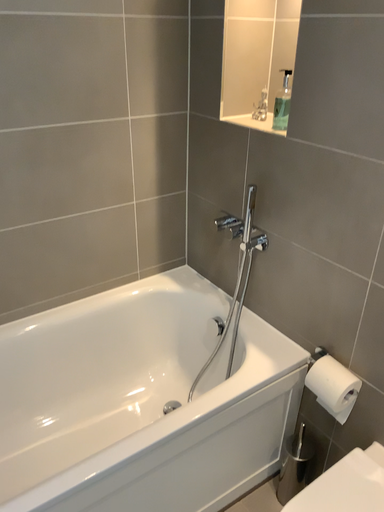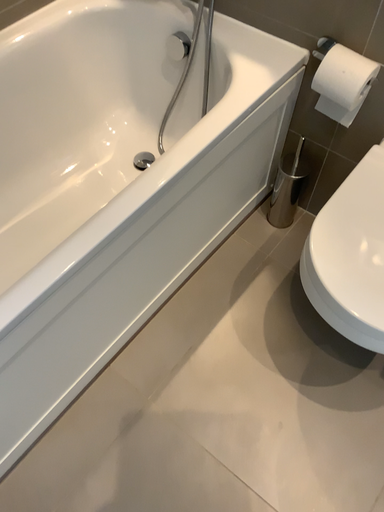
Question: Which way did the camera rotate in the video?

Choices:
 (A) rotated left
 (B) rotated right

Answer: (B)